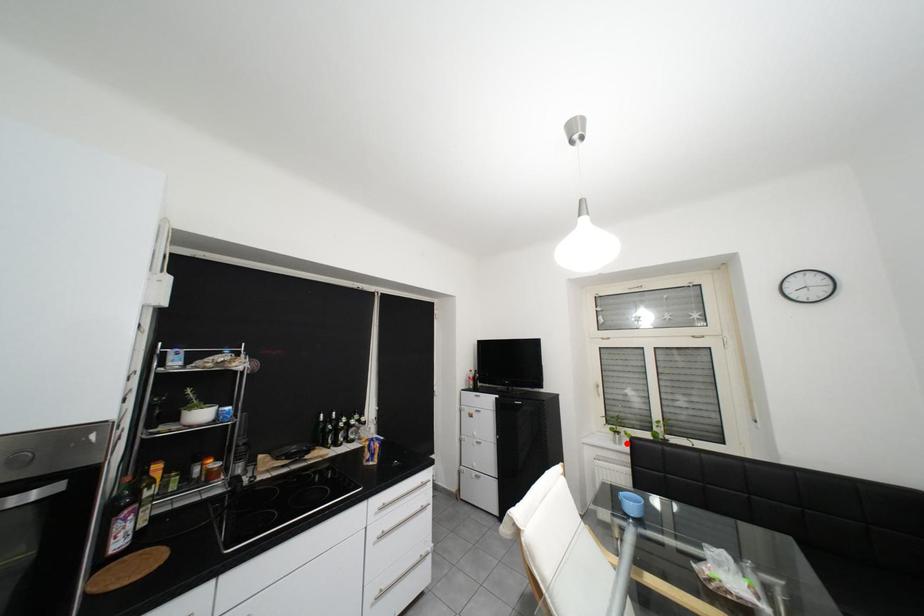
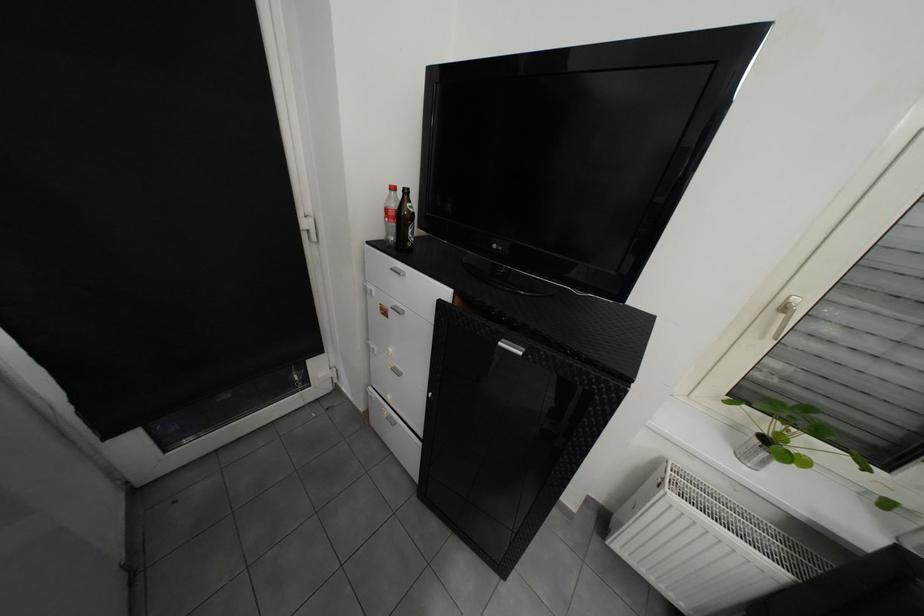
Where in the second image is the point corresponding to the highlighted location from the first image?

(754, 458)